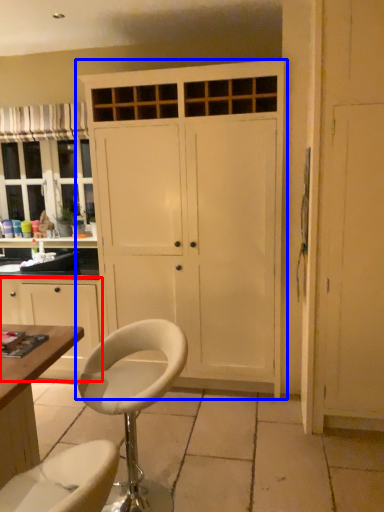
Question: Which point is further to the camera, cabinetry (highlighted by a red box) or cupboard (highlighted by a blue box)?

Choices:
 (A) cabinetry
 (B) cupboard

Answer: (A)